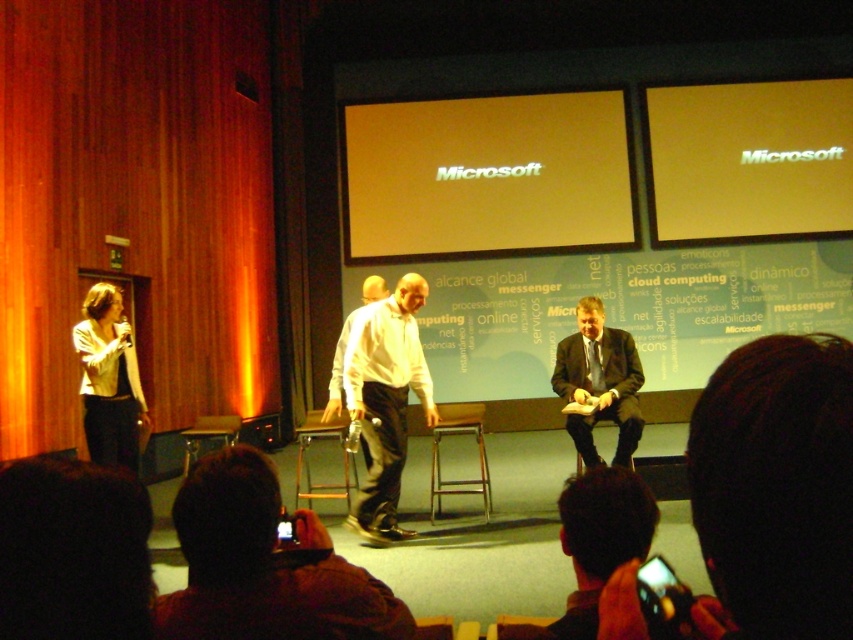
Question: Does yellow matte projection screen at center have a larger size compared to matte white shirt at left?

Choices:
 (A) no
 (B) yes

Answer: (B)

Question: Estimate the real-world distances between objects in this image. Which object is closer to the dark brown leather shoes at lower center?

Choices:
 (A) dark blue suit at center
 (B) silky black hair at lower right
 (C) wooden at center

Answer: (B)

Question: Is silky black hair at lower right smaller than white shirt at center?

Choices:
 (A) yes
 (B) no

Answer: (A)

Question: In this image, where is white matte shirt at center located relative to wooden at center?

Choices:
 (A) below
 (B) above

Answer: (B)

Question: Which object appears closest to the camera in this image?

Choices:
 (A) wooden at center
 (B) silky black hair at lower right
 (C) metallic gold chair at center

Answer: (B)

Question: Estimate the real-world distances between objects in this image. Which object is closer to the yellow matte projection screen at center?

Choices:
 (A) matte white shirt at left
 (B) wooden at center

Answer: (B)